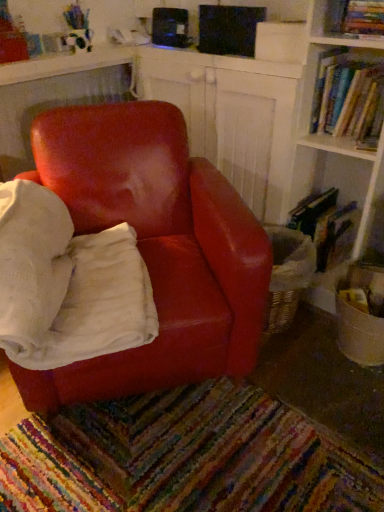
Question: Considering the relative sizes of hardcover books at upper right, the 2th book in the top-to-bottom sequence, and hardcover book at upper right, the third book in the bottom-to-top sequence, in the image provided, is hardcover books at upper right, the 2th book in the top-to-bottom sequence, wider than hardcover book at upper right, the third book in the bottom-to-top sequence,?

Choices:
 (A) no
 (B) yes

Answer: (B)

Question: From the image's perspective, is hardcover books at upper right, positioned as the 2th book in bottom-to-top order, below hardcover book at upper right, the third book in the bottom-to-top sequence?

Choices:
 (A) no
 (B) yes

Answer: (B)

Question: Does hardcover books at upper right, the 2th book in the top-to-bottom sequence, have a lesser width compared to hardcover book at upper right, the third book in the bottom-to-top sequence?

Choices:
 (A) no
 (B) yes

Answer: (A)

Question: Could you tell me if hardcover books at upper right, positioned as the 2th book in bottom-to-top order, is turned towards hardcover book at upper right, the third book in the bottom-to-top sequence?

Choices:
 (A) no
 (B) yes

Answer: (A)

Question: Is hardcover books at upper right, the 2th book in the top-to-bottom sequence, facing away from hardcover book at upper right, the 1th book in the top-to-bottom sequence?

Choices:
 (A) yes
 (B) no

Answer: (B)

Question: Is hardcover books at upper right, the 2th book in the top-to-bottom sequence, inside the boundaries of hardcover book at upper right, the 1th book in the top-to-bottom sequence, or outside?

Choices:
 (A) outside
 (B) inside

Answer: (A)

Question: Considering the positions of hardcover books at upper right, positioned as the 2th book in bottom-to-top order, and hardcover book at upper right, the third book in the bottom-to-top sequence, in the image, is hardcover books at upper right, positioned as the 2th book in bottom-to-top order, bigger or smaller than hardcover book at upper right, the third book in the bottom-to-top sequence,?

Choices:
 (A) small
 (B) big

Answer: (B)

Question: Considering their positions, is hardcover books at upper right, positioned as the 2th book in bottom-to-top order, located in front of or behind hardcover book at upper right, the third book in the bottom-to-top sequence?

Choices:
 (A) front
 (B) behind

Answer: (B)

Question: From a real-world perspective, is hardcover books at upper right, the 2th book in the top-to-bottom sequence, physically located above or below hardcover book at upper right, the 1th book in the top-to-bottom sequence?

Choices:
 (A) above
 (B) below

Answer: (B)

Question: Considering the positions of point (344, 77) and point (244, 361), is point (344, 77) closer or farther from the camera than point (244, 361)?

Choices:
 (A) closer
 (B) farther

Answer: (B)

Question: In terms of height, does hardcover books at upper right, positioned as the 2th book in bottom-to-top order, look taller or shorter compared to matte leather chair at center?

Choices:
 (A) tall
 (B) short

Answer: (B)

Question: In terms of width, does hardcover books at upper right, the 2th book in the top-to-bottom sequence, look wider or thinner when compared to matte leather chair at center?

Choices:
 (A) wide
 (B) thin

Answer: (B)

Question: Based on their positions, is hardcover books at upper right, positioned as the 2th book in bottom-to-top order, located to the left or right of matte leather chair at center?

Choices:
 (A) left
 (B) right

Answer: (B)

Question: Based on their positions, is hardcover book at right, marked as the 1th book in a bottom-to-top arrangement, located to the left or right of hardcover book at upper right, the 1th book in the top-to-bottom sequence?

Choices:
 (A) left
 (B) right

Answer: (A)

Question: From the image's perspective, is hardcover book at right, marked as the 1th book in a bottom-to-top arrangement, located above or below hardcover book at upper right, the third book in the bottom-to-top sequence?

Choices:
 (A) below
 (B) above

Answer: (A)